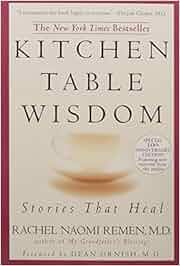
You are a GUI agent. You are given a task and a screenshot of the screen. Output one action in this format:
    pyautogui.click(x=<x>, y=<y>)
    Task: Click on the shadow under saucer
    This screenshot has width=180, height=266.
    Given the screenshot: What is the action you would take?
    pos(85,189)